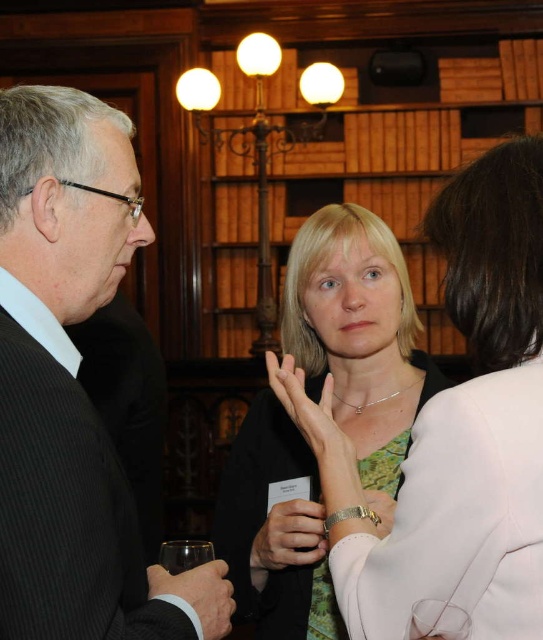
Question: Is green fabric hand at center closer to camera compared to transparent glass at lower left?

Choices:
 (A) no
 (B) yes

Answer: (A)

Question: Is matte green dress at center smaller than transparent glass at lower left?

Choices:
 (A) no
 (B) yes

Answer: (A)

Question: Does smooth silver ring at center appear over black smooth suit at lower left?

Choices:
 (A) no
 (B) yes

Answer: (A)

Question: Among these points, which one is farthest from the camera?

Choices:
 (A) (363, 627)
 (B) (281, 625)
 (C) (168, 566)

Answer: (B)

Question: Among these points, which one is farthest from the camera?

Choices:
 (A) (171, 548)
 (B) (8, 134)

Answer: (A)

Question: Considering the real-world distances, which object is farthest from the black textured suit at left?

Choices:
 (A) white leather jacket at center
 (B) smooth silver ring at center

Answer: (B)